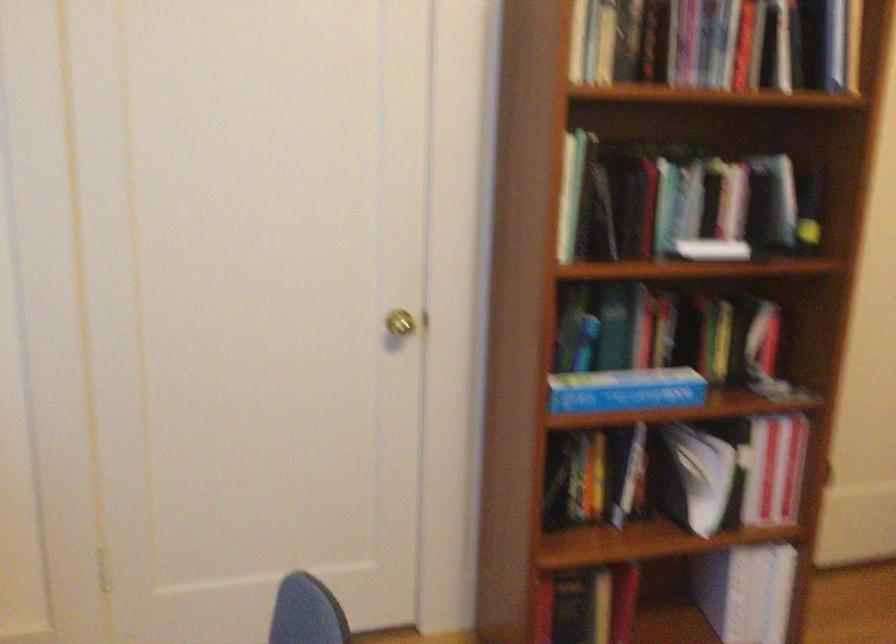
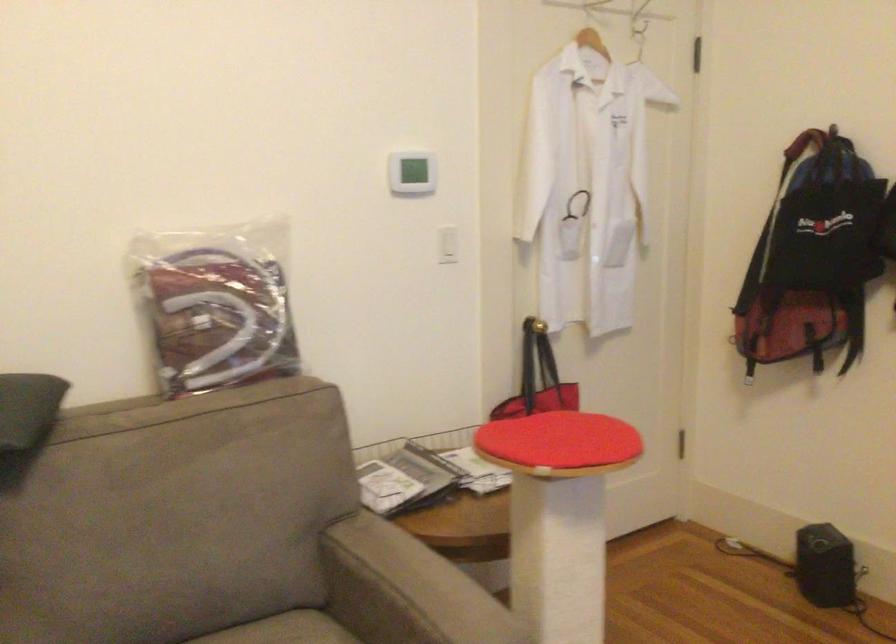
Question: How did the camera likely rotate?

Choices:
 (A) Left
 (B) Right
 (C) Up
 (D) Down

Answer: (B)